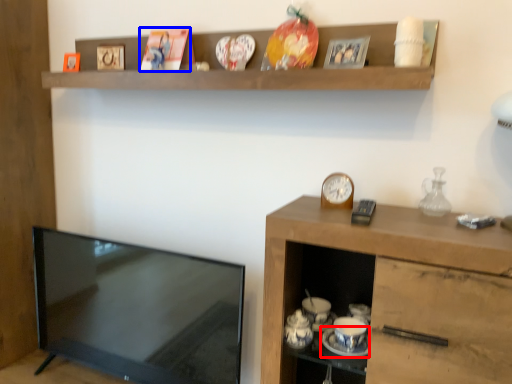
Question: Which of the following is the farthest to the observer, saucer (highlighted by a red box) or picture frame (highlighted by a blue box)?

Choices:
 (A) saucer
 (B) picture frame

Answer: (B)